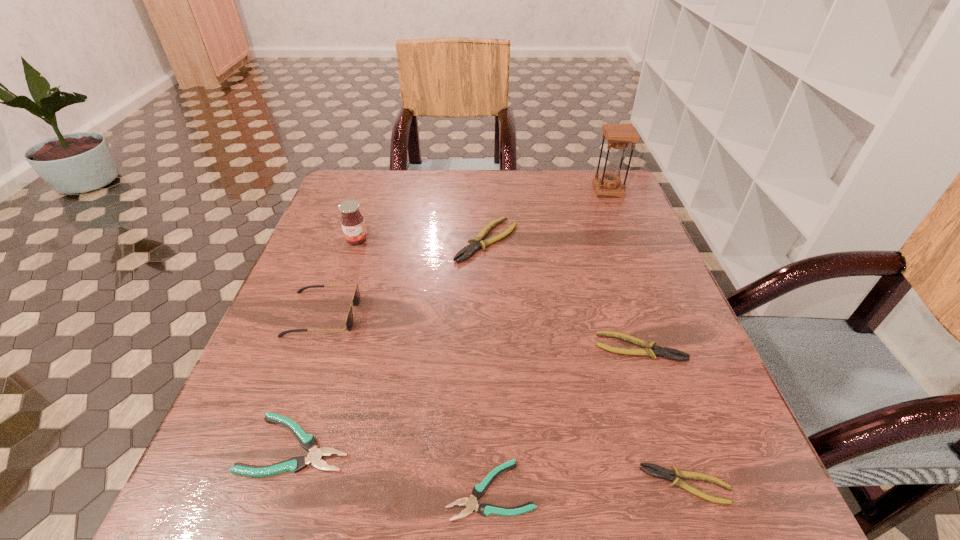
In the image, there is a desktop. Where is `vacant space at the far edge`? The height and width of the screenshot is (540, 960). vacant space at the far edge is located at coordinates (389, 215).

This screenshot has height=540, width=960. Find the location of `free space at the left edge`. free space at the left edge is located at coordinates (302, 286).

You are a GUI agent. You are given a task and a screenshot of the screen. Output one action in this format:
    pyautogui.click(x=<x>, y=<y>)
    Task: Click on the vacant area at the right edge of the desktop
    The width and height of the screenshot is (960, 540).
    Given the screenshot: What is the action you would take?
    pyautogui.click(x=625, y=288)

Find the location of a particular element. This screenshot has height=540, width=960. free spot at the far left corner of the desktop is located at coordinates (335, 202).

Where is `vacant position at the near left corner of the desktop`? The height and width of the screenshot is (540, 960). vacant position at the near left corner of the desktop is located at coordinates (246, 496).

Locate an element on the screen. This screenshot has width=960, height=540. vacant space at the near right corner of the desktop is located at coordinates (754, 520).

Locate an element on the screen. The image size is (960, 540). vacant area between the hourglass and the jam is located at coordinates (482, 215).

Find the location of `empty location between the smallest yellow pliers and the black sunglasses`. empty location between the smallest yellow pliers and the black sunglasses is located at coordinates (504, 400).

Where is `unoccupied position between the smallest yellow pliers and the leftmost yellow pliers`? The height and width of the screenshot is (540, 960). unoccupied position between the smallest yellow pliers and the leftmost yellow pliers is located at coordinates (587, 363).

Locate an element on the screen. This screenshot has height=540, width=960. vacant region between the smaller teal pliers and the hourglass is located at coordinates click(549, 340).